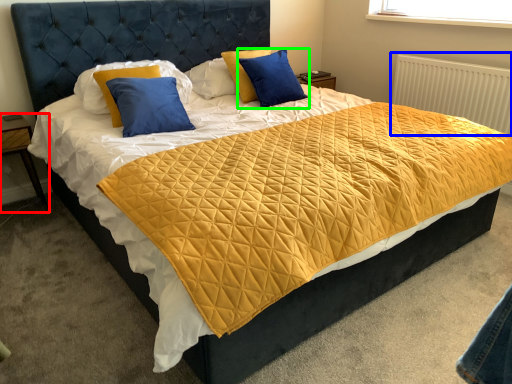
Question: Estimate the real-world distances between objects in this image. Which object is farther from nightstand (highlighted by a red box), radiator (highlighted by a blue box) or pillow (highlighted by a green box)?

Choices:
 (A) radiator
 (B) pillow

Answer: (A)